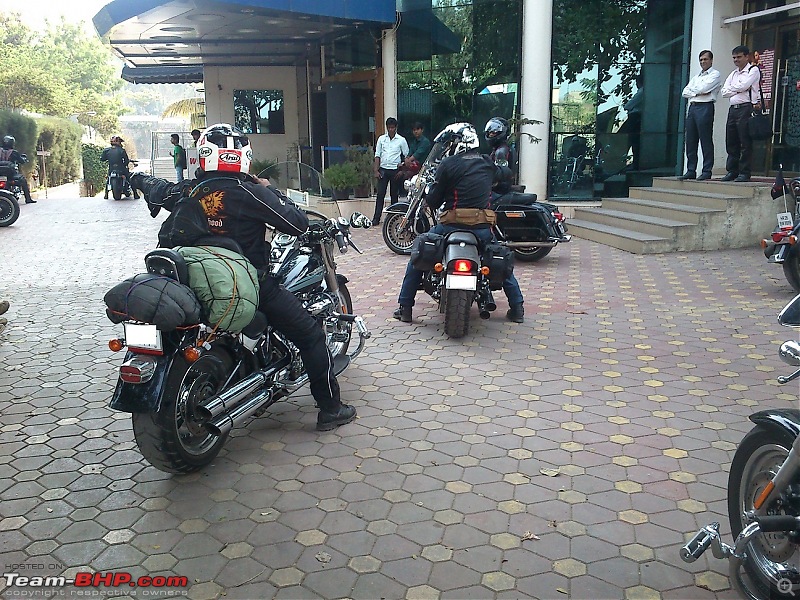
I want to click on steps stairs, so click(658, 204).